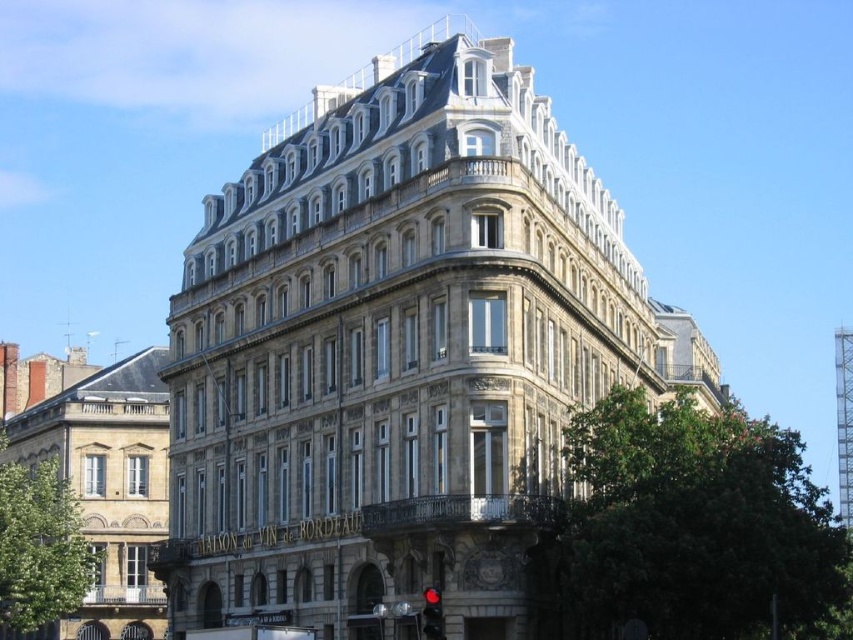
You are a delivery drone that can carry packages weighing up to 5 kilograms. You are currently hovering above the matte beige building at left and need to deliver a package to the red glass traffic light at lower center. The maximum distance your drone can travel is 50 meters. Can you safely make this delivery without needing to recharge?

The distance between the matte beige building at left and the red glass traffic light at lower center is 42.61 meters, which is within the drone maximum travel distance of 50 meters. Therefore, the drone can safely make the delivery without needing to recharge.

You are standing at the base of the grand building and want to take a photo of the point located at coordinate point (82, 428). Your camera has a maximum focus range of 100 meters. Can your camera capture the point clearly?

The point at coordinate point (82, 428) is 98.69 meters away from the camera, which is within the maximum focus range of 100 meters. Therefore, the camera can capture the point clearly.

You are standing on the ground floor of the stone building at center and want to go to the matte beige building at left. Which direction should you move to reach it?

Since the stone building at center is located above the matte beige building at left, you should move downward to reach the matte beige building at left.